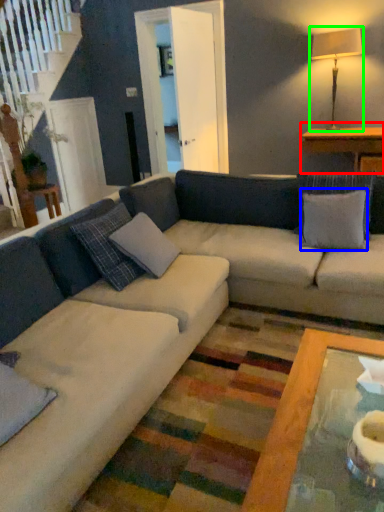
Question: Based on their relative distances, which object is farther from table (highlighted by a red box)? Choose from pillow (highlighted by a blue box) and table lamp (highlighted by a green box).

Choices:
 (A) pillow
 (B) table lamp

Answer: (A)